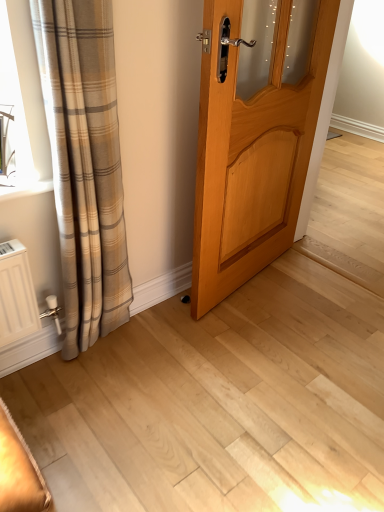
Identify the location of free space on the front side of light wood door at center. This screenshot has height=512, width=384. (268, 349).